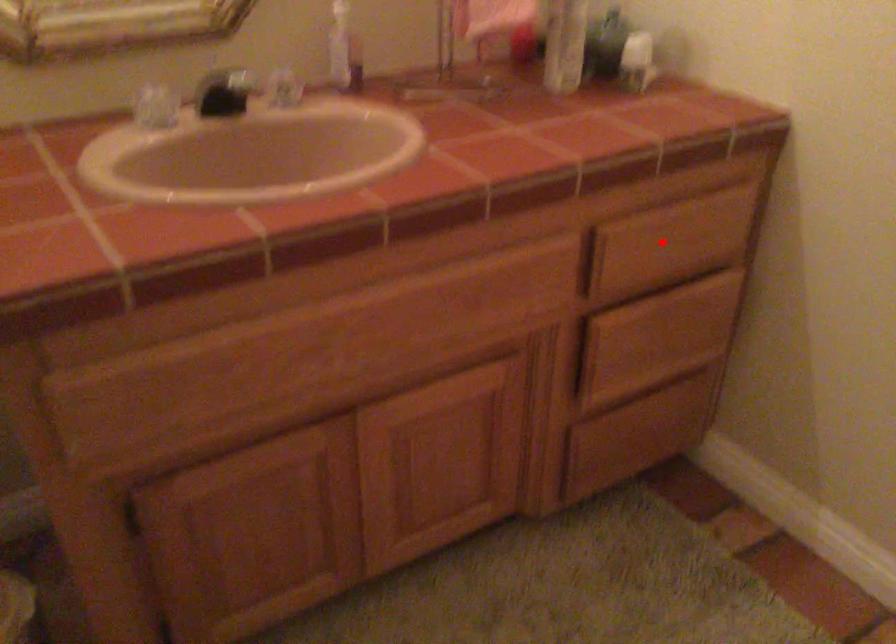
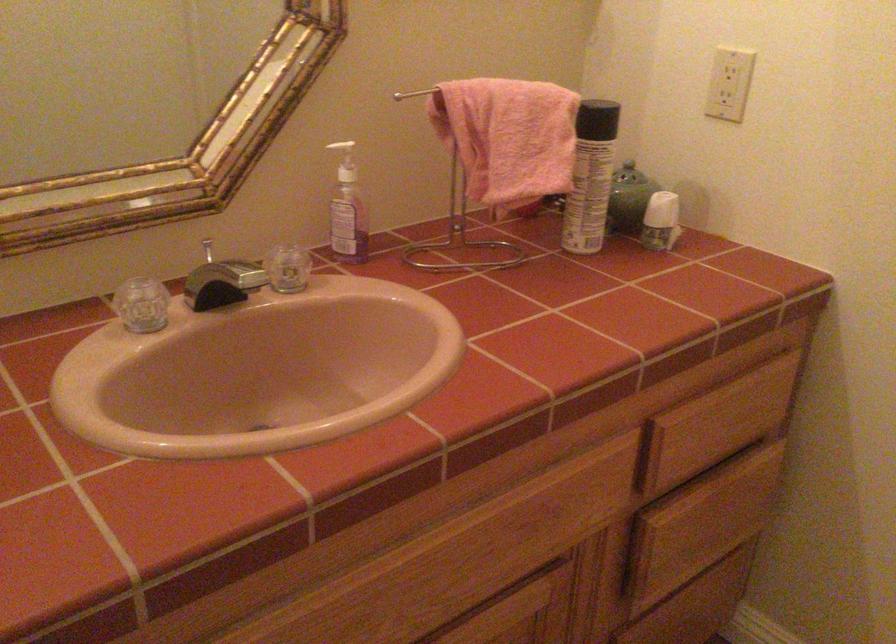
Question: I am providing you with two images of the same scene from different viewpoints. Image1 has a red point marked. In image2, the corresponding 3D location appears at what relative position? Reply with the corresponding letter.

Choices:
 (A) Closer
 (B) Farther

Answer: (A)